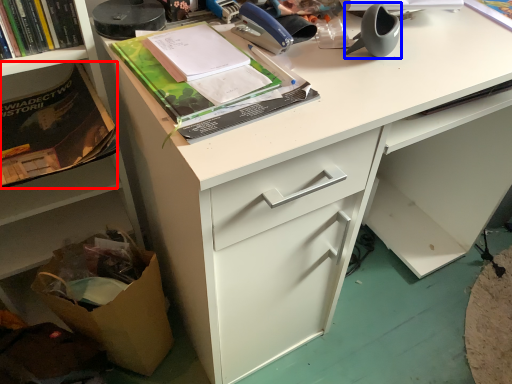
Question: Which point is further to the camera, paperback book (highlighted by a red box) or office supplies (highlighted by a blue box)?

Choices:
 (A) paperback book
 (B) office supplies

Answer: (A)